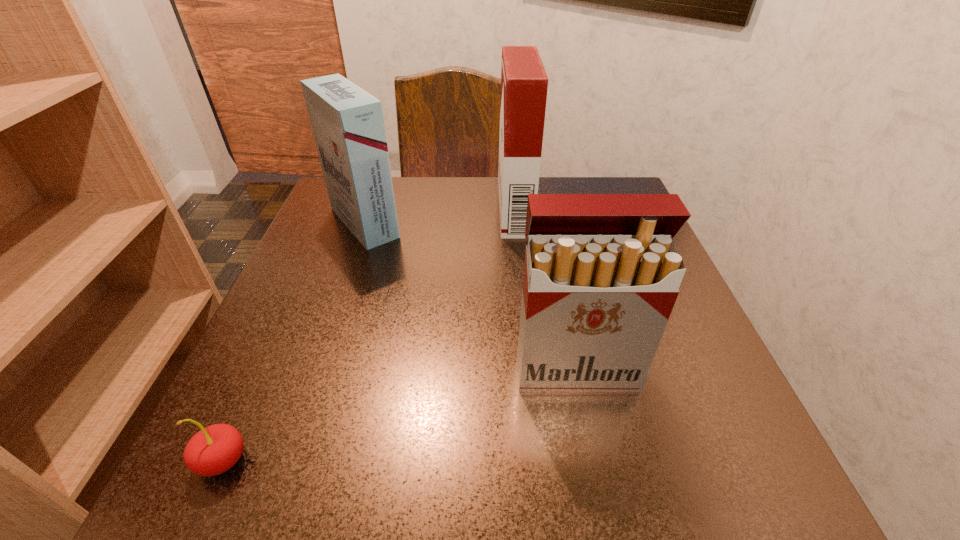
Locate an element on the screen. Image resolution: width=960 pixels, height=540 pixels. object that is at the right edge is located at coordinates (602, 272).

Locate an element on the screen. object located in the far left corner section of the desktop is located at coordinates (347, 122).

The height and width of the screenshot is (540, 960). Find the location of `object situated at the near left corner`. object situated at the near left corner is located at coordinates (215, 449).

Where is `free space at the far edge of the desktop`? Image resolution: width=960 pixels, height=540 pixels. free space at the far edge of the desktop is located at coordinates (416, 225).

In the image, there is a desktop. Where is `free space at the near edge`? The height and width of the screenshot is (540, 960). free space at the near edge is located at coordinates (592, 476).

The height and width of the screenshot is (540, 960). I want to click on free space at the left edge, so click(x=367, y=274).

This screenshot has height=540, width=960. What are the coordinates of `vacant space at the right edge of the desktop` in the screenshot? It's located at (711, 389).

Image resolution: width=960 pixels, height=540 pixels. I want to click on vacant space at the near left corner, so click(x=206, y=504).

In order to click on vacant space at the far right corner of the desktop in this screenshot , I will do `click(614, 190)`.

Where is `empty space between the nearest object and the second nearest object`? Image resolution: width=960 pixels, height=540 pixels. empty space between the nearest object and the second nearest object is located at coordinates (399, 415).